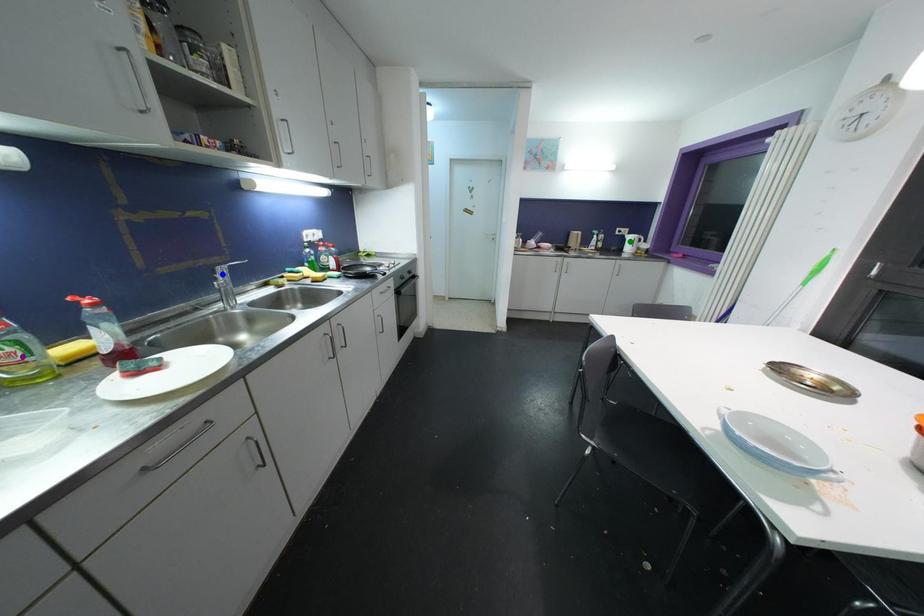
Order these from nearest to farthest:
green point, purple point, blue point

purple point, blue point, green point